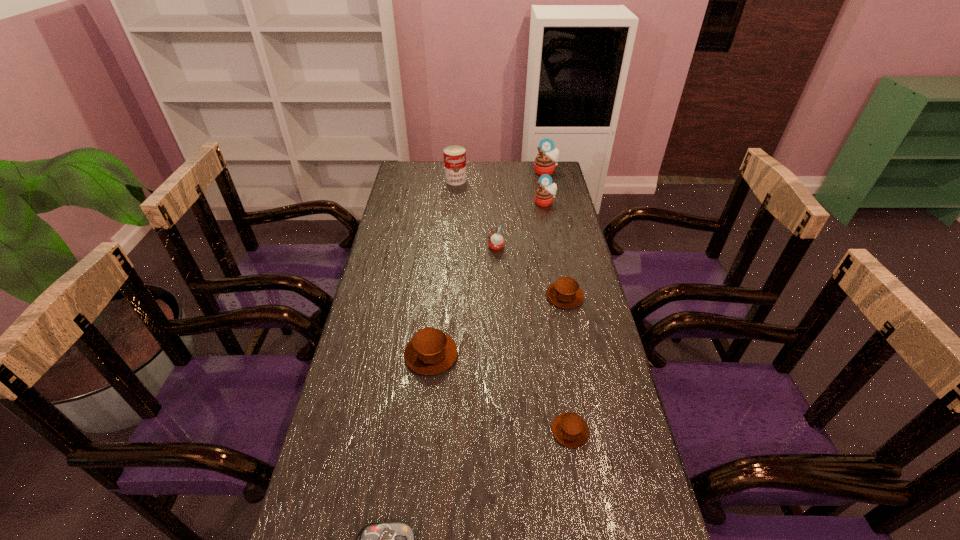
Identify the location of vacant space located on the left of the sixth tallest object. (427, 296).

Identify the location of vacant region located on the back of the nearest muffin. The width and height of the screenshot is (960, 540). (558, 356).

Find the location of a particular element. The height and width of the screenshot is (540, 960). muffin that is positioned at the far edge is located at coordinates (545, 162).

What are the coordinates of `can positioned at the far edge` in the screenshot? It's located at (454, 156).

The height and width of the screenshot is (540, 960). I want to click on object that is at the left edge, so click(x=430, y=351).

Locate an element on the screen. Image resolution: width=960 pixels, height=540 pixels. object at the far right corner is located at coordinates (545, 162).

Locate an element on the screen. The width and height of the screenshot is (960, 540). free space at the far edge of the desktop is located at coordinates (487, 171).

Locate an element on the screen. The height and width of the screenshot is (540, 960). free space at the left edge is located at coordinates (407, 220).

Identify the location of free spot at the right edge of the desktop. [559, 232].

Where is `free spot between the third nearest muffin and the can`? free spot between the third nearest muffin and the can is located at coordinates (511, 238).